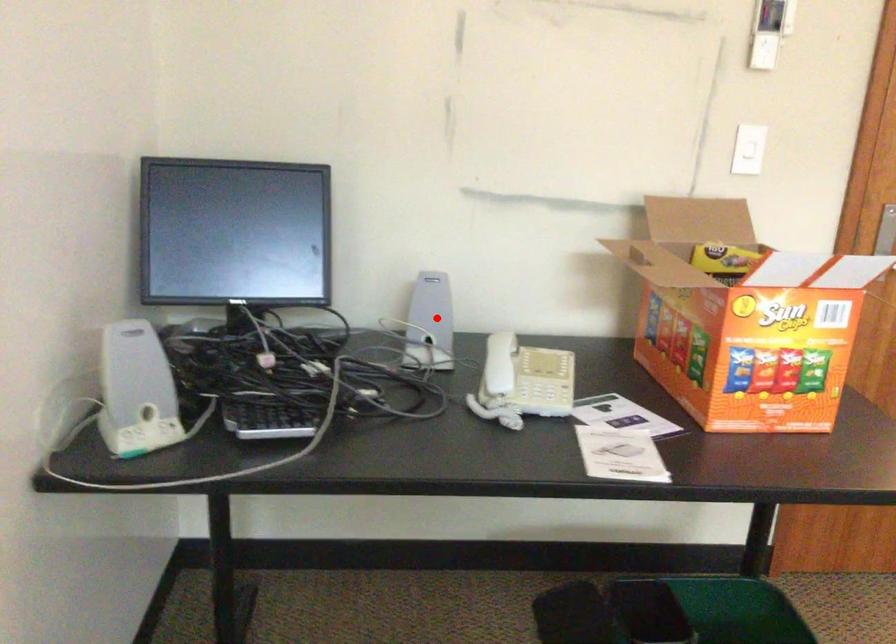
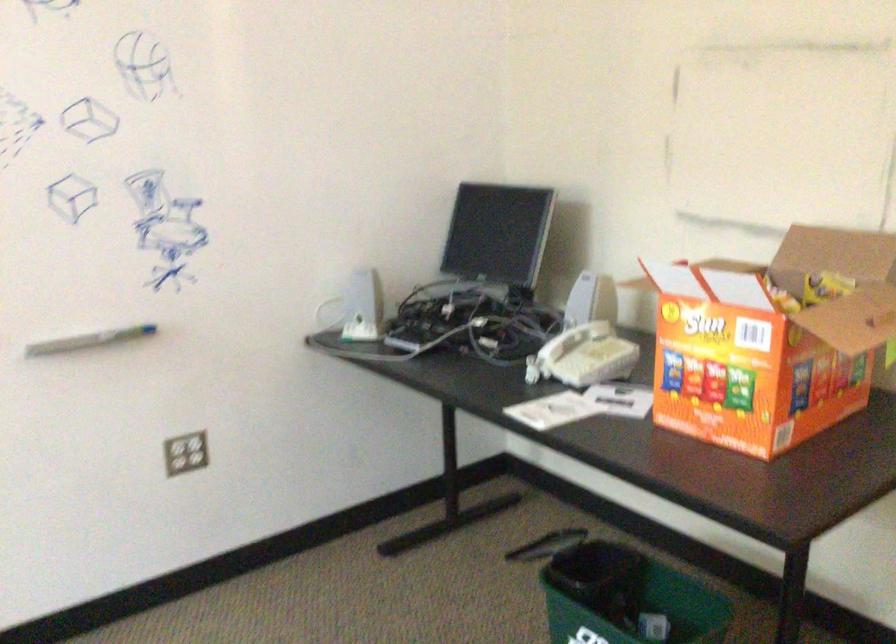
Question: I am providing you with two images of the same scene from different viewpoints. Image1 has a red point marked. In image2, the corresponding 3D location appears at what relative position? Reply with the corresponding letter.

Choices:
 (A) Closer
 (B) Farther

Answer: (B)